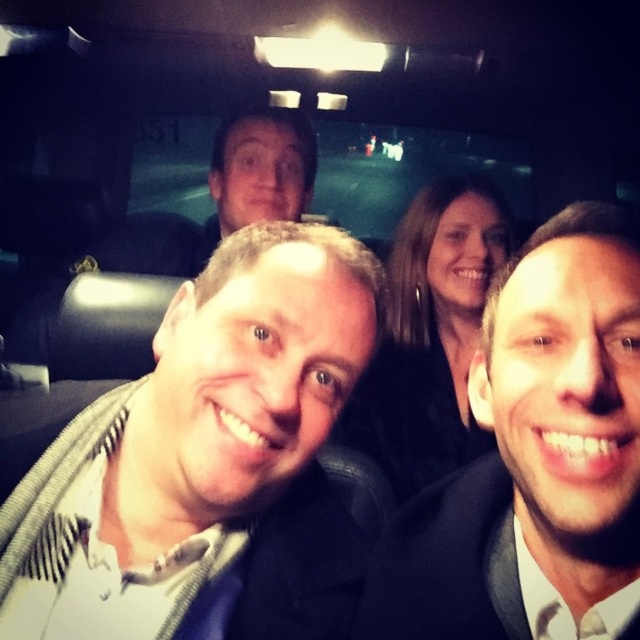
You are standing 21.42 inches away from the point at coordinates (252, 236). If you want to take a photo of this point with a camera that has a 120mm focal length, what is the angle of view required to capture the point in the frame?

The angle of view required to capture the point at coordinates (252, 236) would depend on the camera sensor size and the field of view formula, but since the distance is 21.42 inches, you can calculate it using the formula angle of view equals two times arctangent of half the sensor width divided by the focal length. However, without specific sensor dimensions, we can state that the point is 21.42 inches away from the viewer.

You are a photographer trying to capture a candid shot of the white textured shirt at center and the matte black suit at center from the front of the vehicle. Can you see both subjects clearly in your camera frame without moving your position?

The matte black suit at center is behind the white textured shirt at center, so you cannot see both subjects clearly in your camera frame without moving your position because the white textured shirt at center is blocking the view of the matte black suit at center.